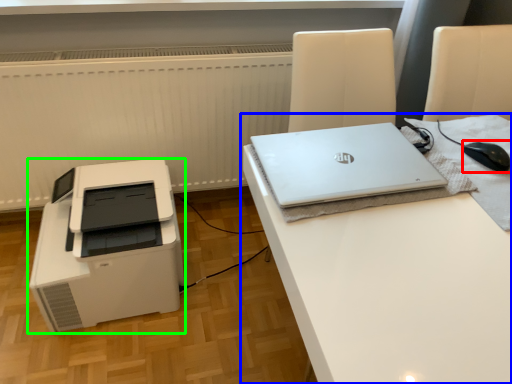
Question: Which object is positioned farthest from mouse (highlighted by a red box)? Select from desk (highlighted by a blue box) and printer (highlighted by a green box).

Choices:
 (A) desk
 (B) printer

Answer: (B)